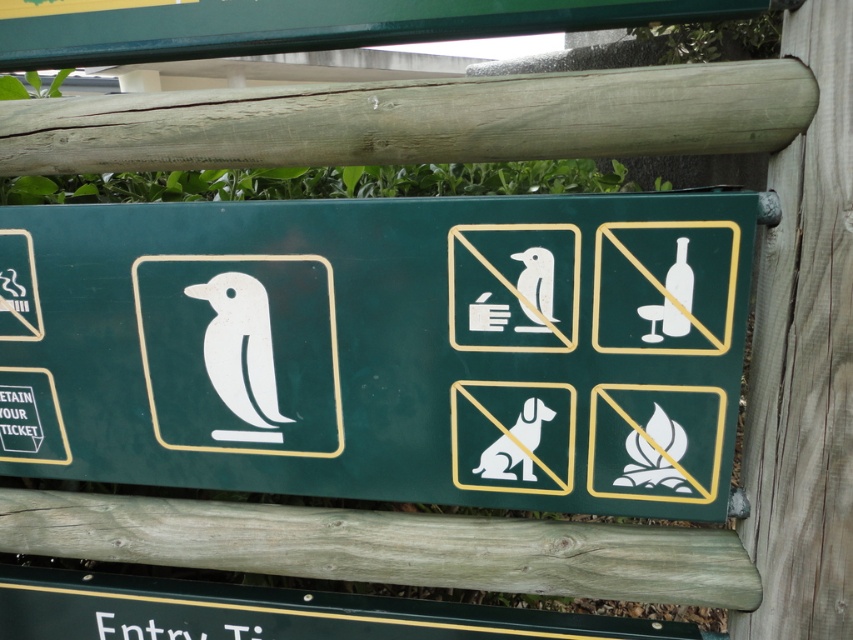
Is weathered wood pole at upper center below green matte sign at upper center?

Indeed, weathered wood pole at upper center is positioned under green matte sign at upper center.

Does weathered wood pole at upper center have a larger size compared to green matte sign at upper center?

Indeed, weathered wood pole at upper center has a larger size compared to green matte sign at upper center.

Is point (184, 147) farther from viewer compared to point (113, 28)?

No, (184, 147) is in front of (113, 28).

Image resolution: width=853 pixels, height=640 pixels. I want to click on weathered wood pole at upper center, so click(x=418, y=120).

In the scene shown: Does matte green sign at center have a greater width compared to green matte sign at upper center?

Yes.

Identify the location of matte green sign at center. (383, 348).

Identify the location of matte green sign at center. (383, 348).

Is point (36, 365) farther from camera compared to point (550, 154)?

Yes.

Is matte green sign at center to the right of weathered wood pole at upper center from the viewer's perspective?

No, matte green sign at center is not to the right of weathered wood pole at upper center.

Does point (438, 204) come closer to viewer compared to point (241, 128)?

Yes, it is in front of point (241, 128).

In order to click on matte green sign at center in this screenshot , I will do `click(383, 348)`.